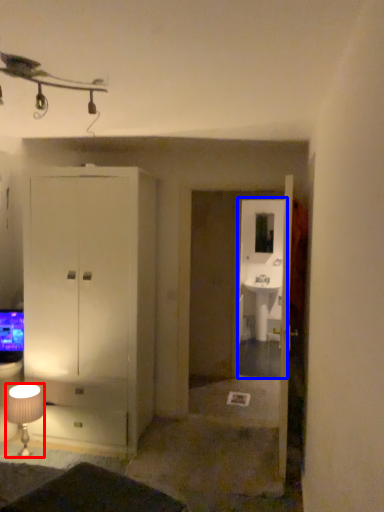
Question: Which object is closer to the camera taking this photo, lamp (highlighted by a red box) or glass door (highlighted by a blue box)?

Choices:
 (A) lamp
 (B) glass door

Answer: (A)